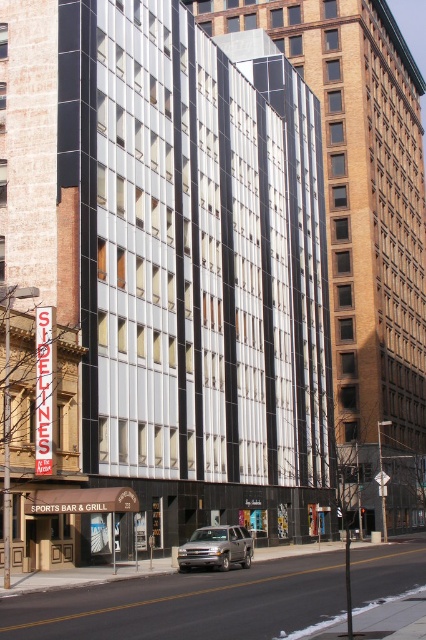
Does glassy reflective building at center have a lesser width compared to silver metallic suv at center?

Incorrect, glassy reflective building at center's width is not less than silver metallic suv at center's.

In the scene shown: Is glassy reflective building at center to the left of silver metallic suv at center from the viewer's perspective?

No, glassy reflective building at center is not to the left of silver metallic suv at center.

Which is behind, point (195, 6) or point (230, 550)?

The point (195, 6) is more distant.

Locate an element on the screen. The height and width of the screenshot is (640, 426). glassy reflective building at center is located at coordinates (362, 227).